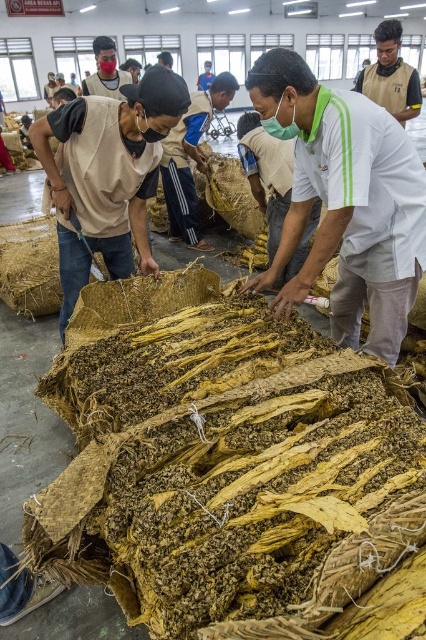
From the picture: You are standing in front of the large pile of dried leaves. There are two points marked on the pile, one at coordinates point (230, 588) and the other at point (328, 120). Which point is closer to you?

Point (230, 588) is closer to you than point (328, 120) because it is closer to the camera.

You are an inspector in the factory and notice two items, the beige fabric mask at left and the matte beige shirt at center. Which item is located more to the left side of the scene?

The beige fabric mask at left is positioned on the left side of the matte beige shirt at center, so it is more to the left side of the scene.

You are an inspector checking safety compliance in the factory. You notice the brown woven mat at center and the white cotton shirt at center. According to the safety sign stating Area Bebas Api, which object is more likely to be a fire hazard and why?

The brown woven mat at center is more likely to be a fire hazard because it is made of flammable materials like straw, which can easily catch fire. The white cotton shirt at center is made of cotton, which is less flammable compared to the woven straw mat.